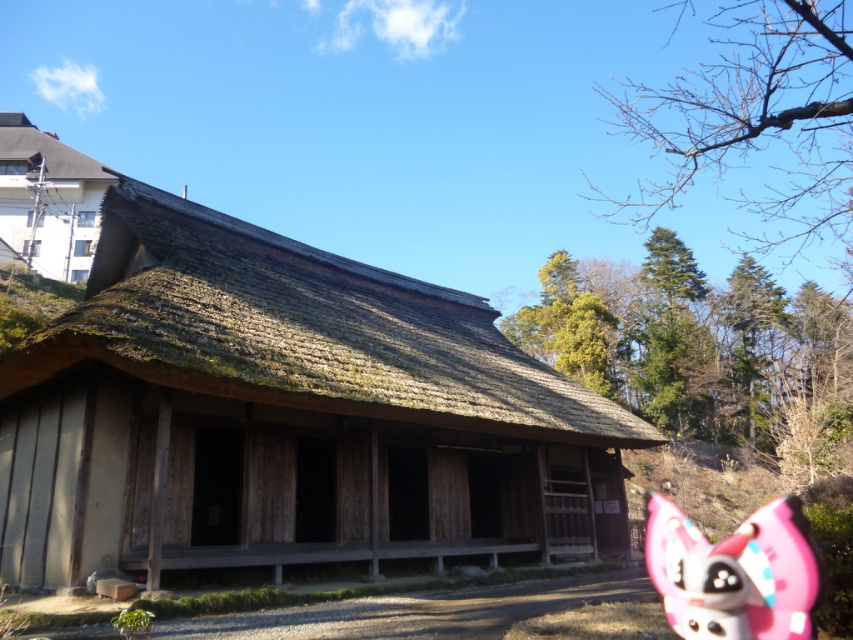
Looking at this image, you are standing at the entrance of the traditional wooden building and want to walk towards the point marked as point (x=3, y=184). However, there is an obstacle at point (x=502, y=515). Will you encounter this obstacle before reaching your destination?

Yes, you will encounter the obstacle at point (x=502, y=515) before reaching point (x=3, y=184) because point (x=502, y=515) is in front of point (x=3, y=184).

You are standing in front of the traditional wooden structure with a thatched roof. You see a pink matte plush toy at lower right and a thatched wood hut at upper left. Which object is nearer to you?

The pink matte plush toy at lower right is closer to the viewer than the thatched wood hut at upper left.